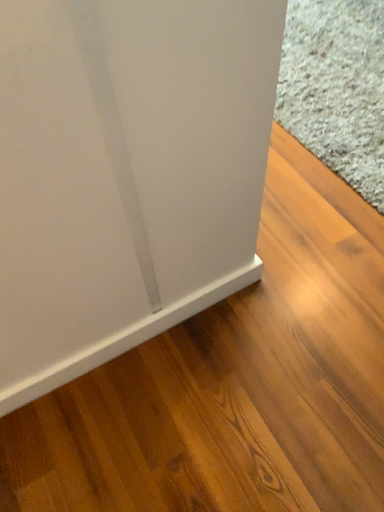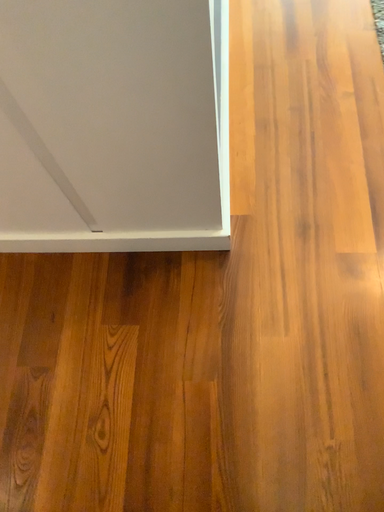
Question: How did the camera likely rotate when shooting the video?

Choices:
 (A) rotated downward
 (B) rotated upward

Answer: (A)